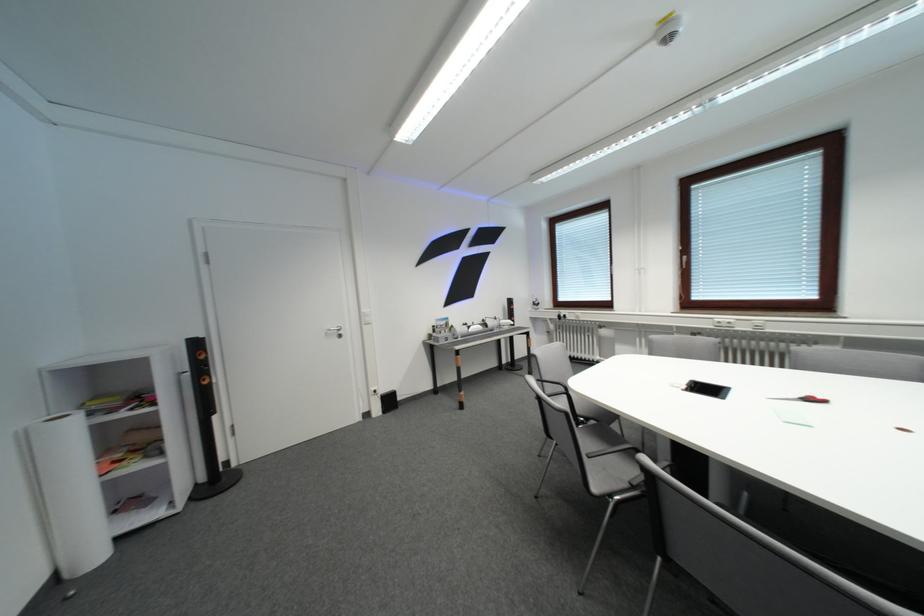
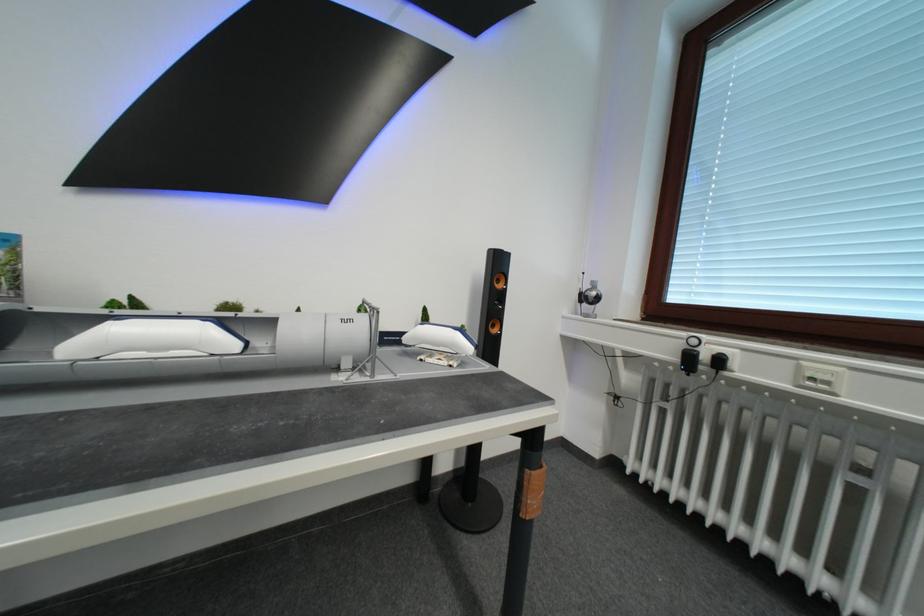
Find the pixel in the second image that matches point (543, 306) in the first image.

(592, 301)